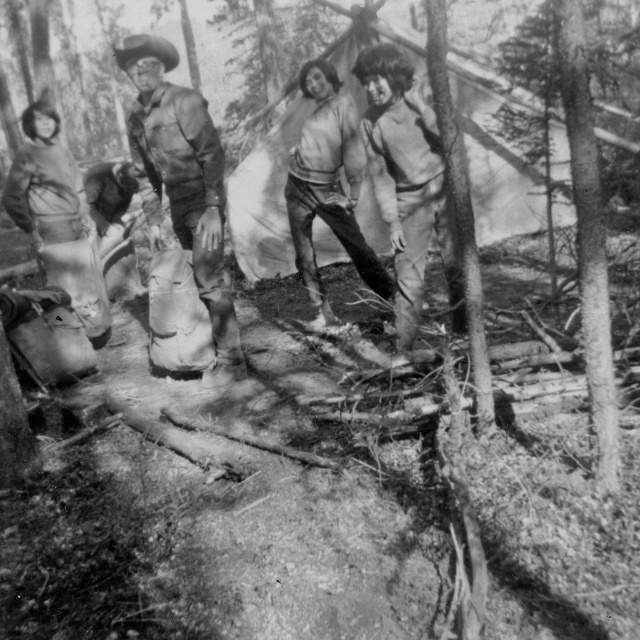
Question: Which object is farther from the camera taking this photo?

Choices:
 (A) matte khaki pants at center
 (B) leather boots at center

Answer: (B)

Question: Does matte khaki pants at center have a lesser width compared to light gray sweater at center?

Choices:
 (A) yes
 (B) no

Answer: (A)

Question: Does leather boots at center appear over light gray sweater at center?

Choices:
 (A) yes
 (B) no

Answer: (B)

Question: Can you confirm if leather boots at center is bigger than light gray sweater at center?

Choices:
 (A) yes
 (B) no

Answer: (B)

Question: Which object is the closest to the light gray sweater at center?

Choices:
 (A) matte khaki pants at center
 (B) leather boots at center

Answer: (A)

Question: Which of the following is the closest to the observer?

Choices:
 (A) matte khaki pants at center
 (B) leather boots at center

Answer: (A)